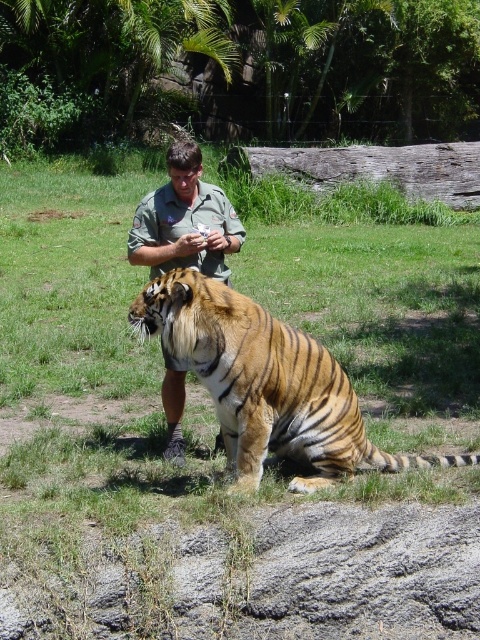
Does orange striped tiger at center appear on the left side of green uniform at center?

No, orange striped tiger at center is not to the left of green uniform at center.

Between orange striped tiger at center and green uniform at center, which one has more height?

Standing taller between the two is orange striped tiger at center.

Which is in front, point (228, 365) or point (233, 243)?

Point (228, 365) is in front.

Where is `orange striped tiger at center`? orange striped tiger at center is located at coordinates (265, 384).